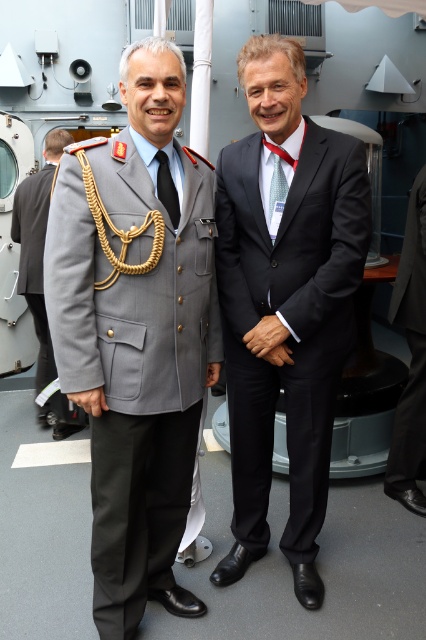
Question: Can you confirm if matte black suit at center is thinner than gray wool military uniform at center?

Choices:
 (A) yes
 (B) no

Answer: (B)

Question: Can you confirm if black glossy suit at center is bigger than gray wool military uniform at center?

Choices:
 (A) no
 (B) yes

Answer: (A)

Question: Which of these objects is positioned closest to the light blue silk tie at center?

Choices:
 (A) matte gray uniform at center
 (B) matte black suit at center
 (C) black glossy suit at center
 (D) gray wool military uniform at center

Answer: (C)

Question: Does matte gray uniform at center have a lesser width compared to matte black suit at center?

Choices:
 (A) yes
 (B) no

Answer: (B)

Question: Estimate the real-world distances between objects in this image. Which object is closer to the matte black suit at center?

Choices:
 (A) gray wool military uniform at center
 (B) matte gray uniform at center

Answer: (B)

Question: Which of these objects is positioned farthest from the black smooth suit at right?

Choices:
 (A) matte black suit at center
 (B) gray wool military uniform at center
 (C) black silk tie at center

Answer: (B)